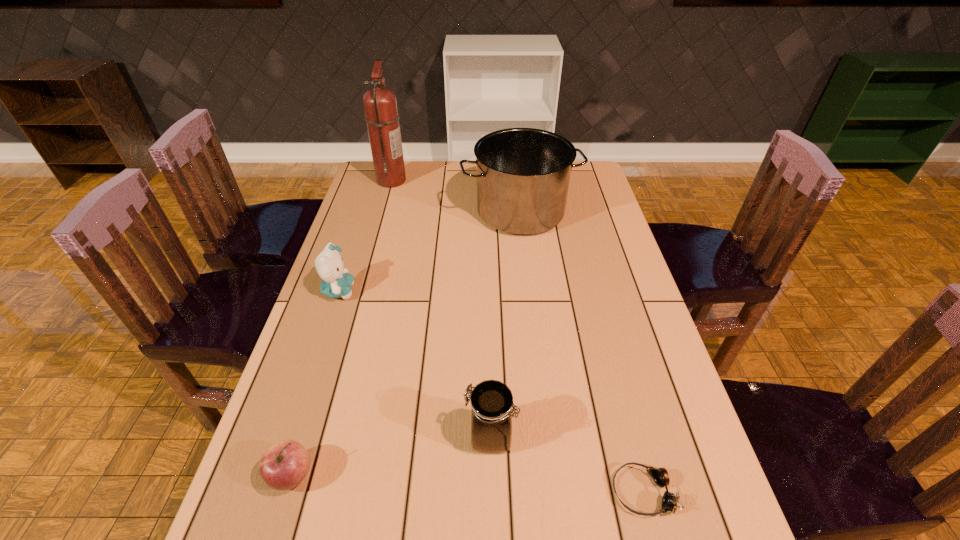
Find the location of a particular element. The width and height of the screenshot is (960, 540). blank area in the image that satisfies the following two spatial constraints: 1. on the lid of the jar; 2. on the front side of the second shortest object is located at coordinates coord(491,475).

Locate an element on the screen. The image size is (960, 540). free space that satisfies the following two spatial constraints: 1. on the lid of the jar; 2. on the front side of the apple is located at coordinates (491, 475).

Locate an element on the screen. vacant point that satisfies the following two spatial constraints: 1. on the front-facing side of the saucepan; 2. on the left side of the fire extinguisher is located at coordinates (383, 212).